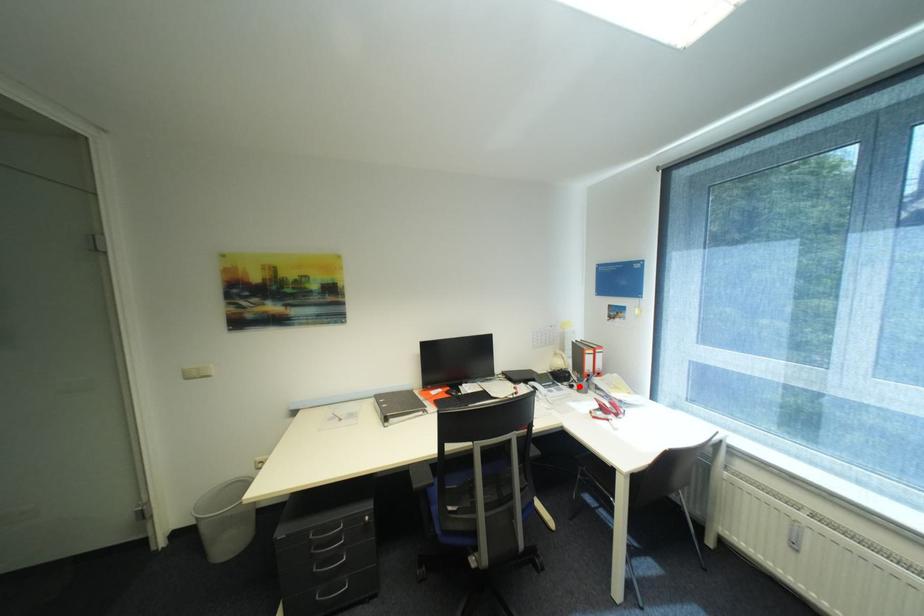
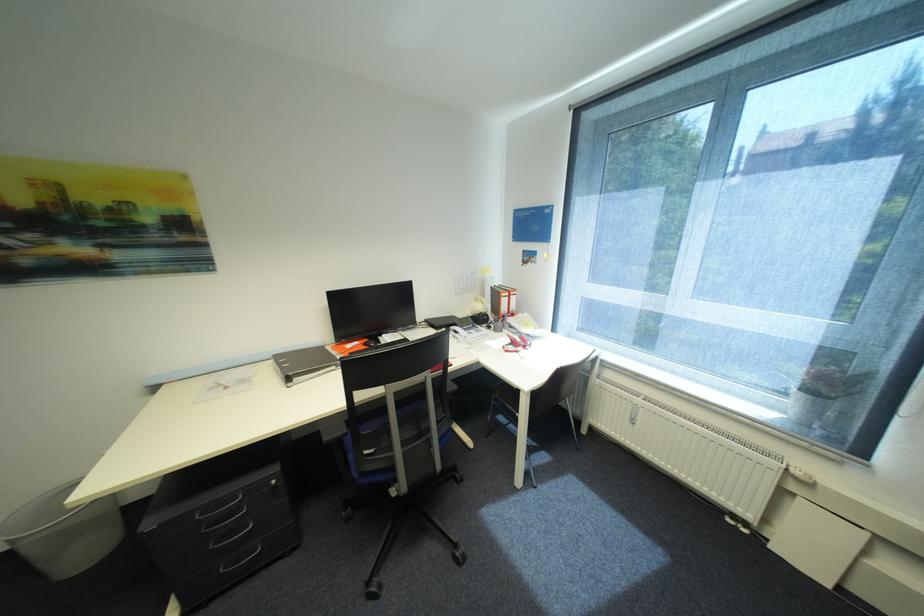
In the second image, find the point that corresponds to the highlighted location in the first image.

(496, 328)